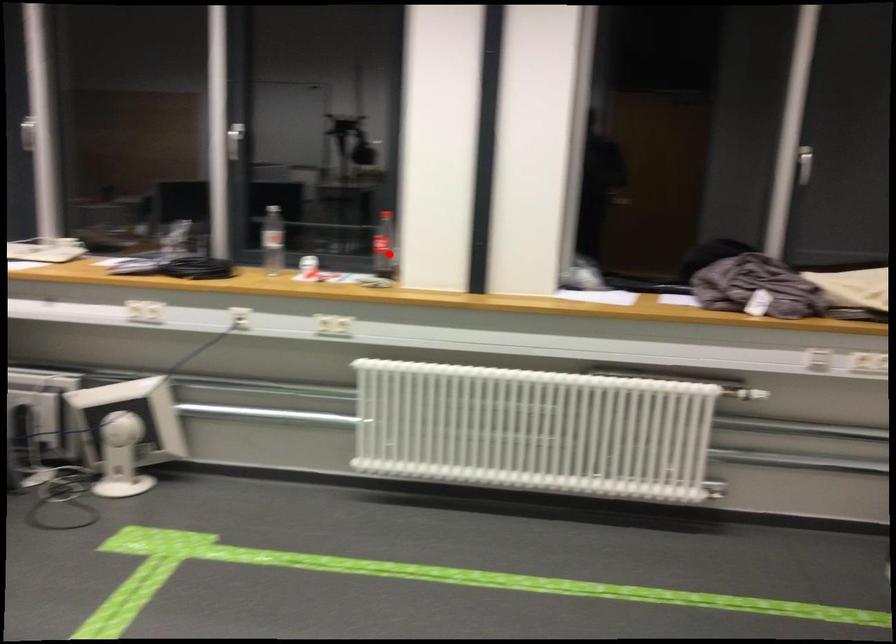
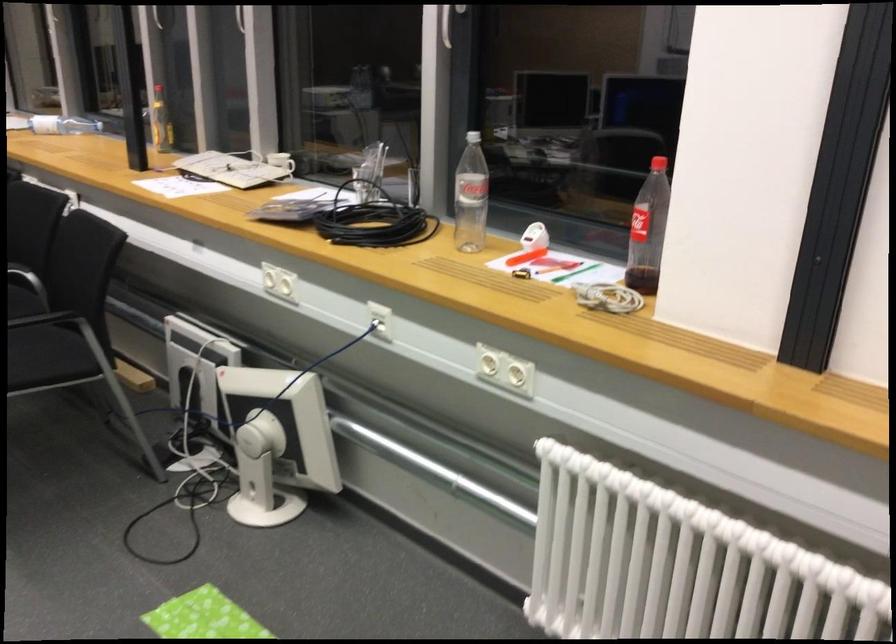
The point at the highlighted location is marked in the first image. Where is the corresponding point in the second image?

(648, 230)